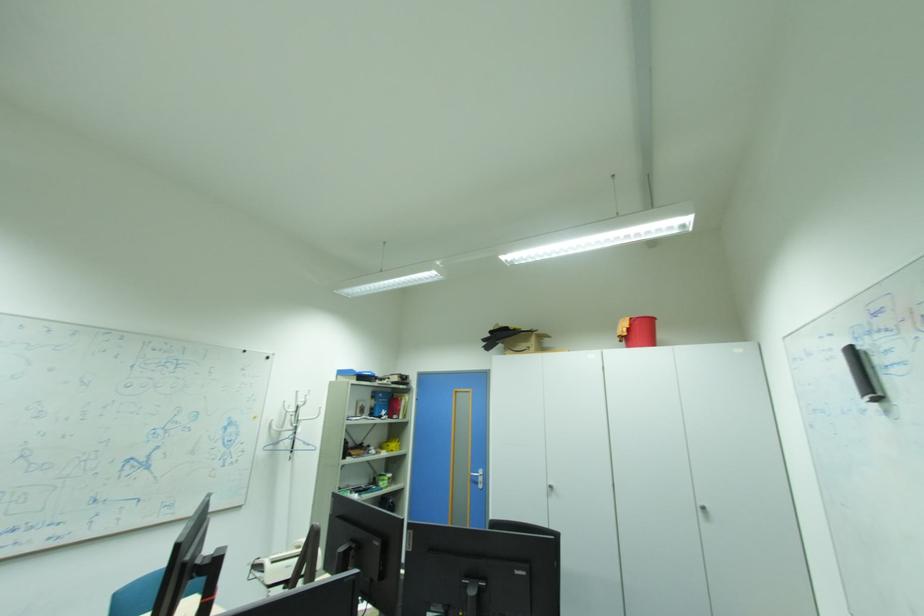
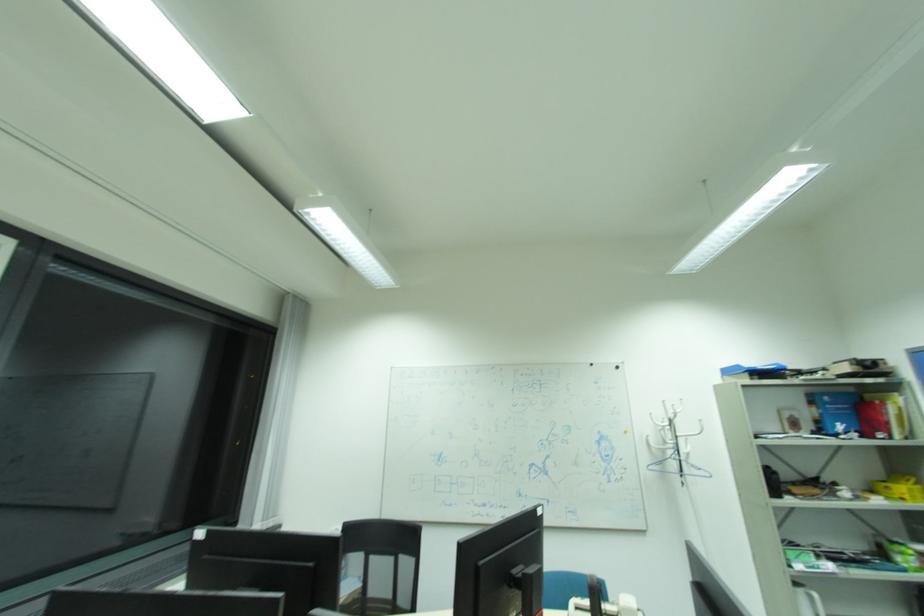
Question: Based on the continuous images, in which direction is the camera rotating? Reply with the corresponding letter.

Choices:
 (A) Left
 (B) Right
 (C) Up
 (D) Down

Answer: (A)